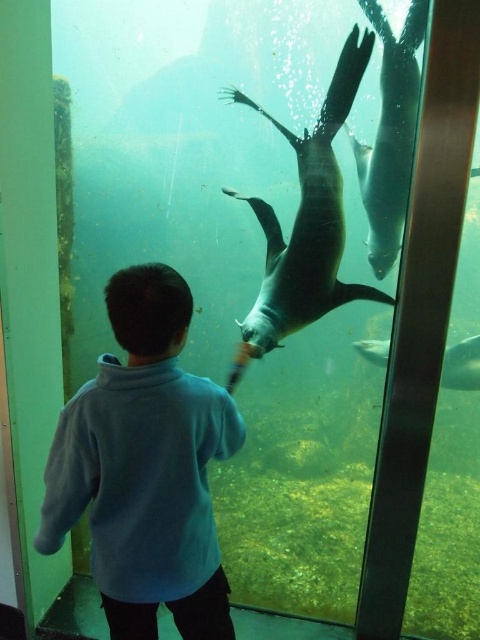
Is blue fleece jacket at center wider than gray matte penguin at upper right?

Yes, blue fleece jacket at center is wider than gray matte penguin at upper right.

Who is more distant from viewer, [204,401] or [375,220]?

Positioned behind is point [375,220].

Identify the location of blue fleece jacket at center. (144, 467).

Consider the image. How much distance is there between smooth gray penguin at center and shiny silver fish at center?

smooth gray penguin at center is 5.19 feet away from shiny silver fish at center.

Which is in front, point (307, 205) or point (460, 348)?

Point (307, 205) is more forward.

The image size is (480, 640). Describe the element at coordinates (308, 218) in the screenshot. I see `smooth gray penguin at center` at that location.

Image resolution: width=480 pixels, height=640 pixels. Identify the location of smooth gray penguin at center. (308, 218).

Which is in front, point (415, 115) or point (371, 353)?

Point (415, 115) is more forward.

Does point (415, 36) lie behind point (472, 376)?

No, (415, 36) is in front of (472, 376).

The height and width of the screenshot is (640, 480). I want to click on gray matte penguin at upper right, so click(391, 134).